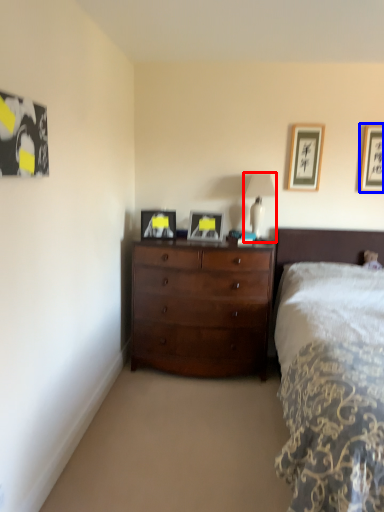
Question: Which point is further to the camera, table lamp (highlighted by a red box) or picture frame (highlighted by a blue box)?

Choices:
 (A) table lamp
 (B) picture frame

Answer: (B)